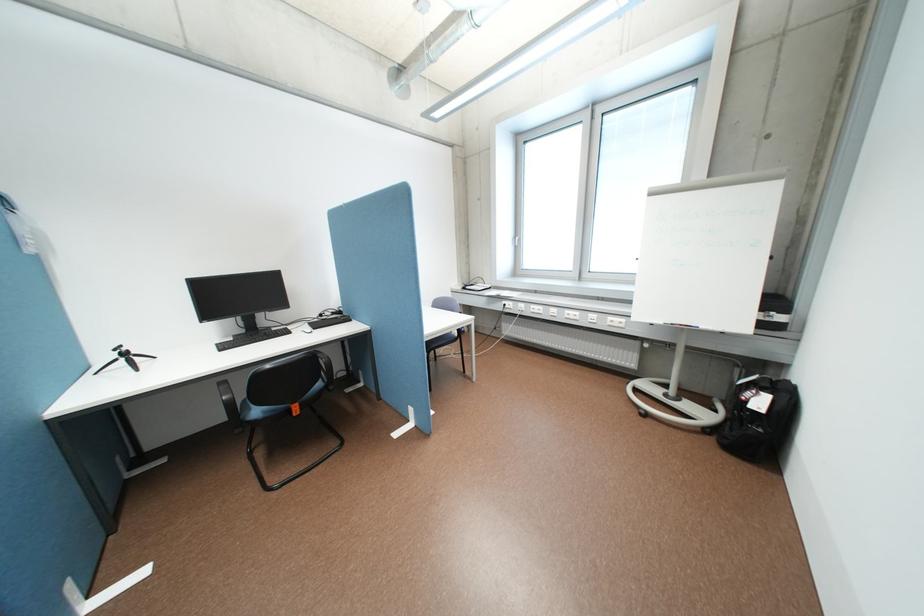
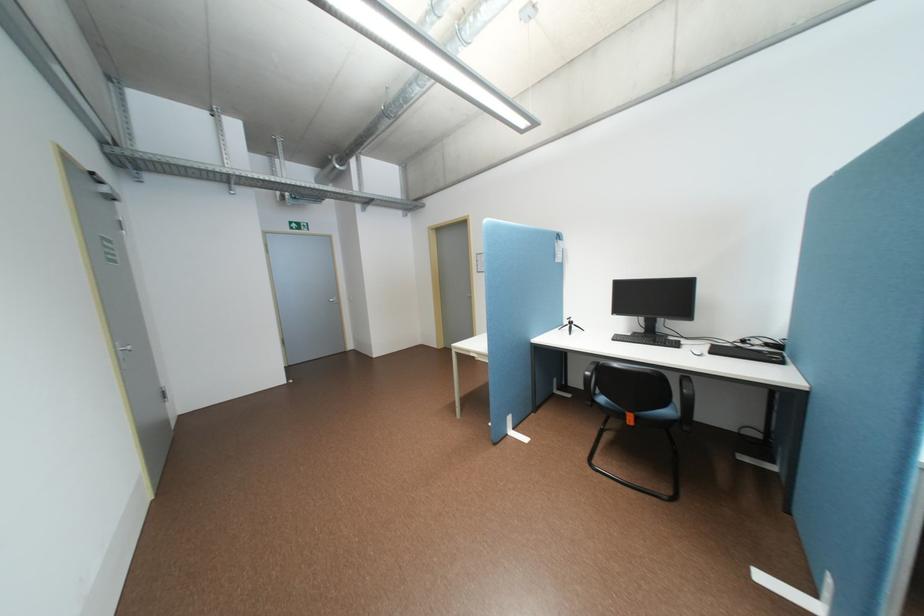
Question: The camera is either moving clockwise (left) or counter-clockwise (right) around the object. The first image is from the beginning of the video and the second image is from the end. Is the camera moving left or right when shooting the video?

Choices:
 (A) Left
 (B) Right

Answer: (B)